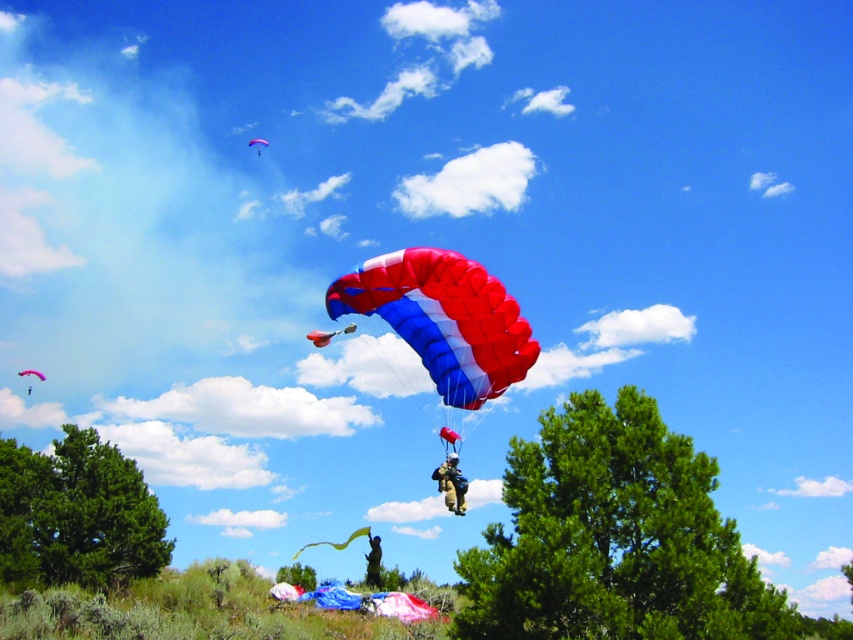
Who is shorter, yellow fabric parachute at center or red nylon parachute at upper center?

red nylon parachute at upper center

Where is `yellow fabric parachute at center`? This screenshot has width=853, height=640. yellow fabric parachute at center is located at coordinates (337, 541).

The width and height of the screenshot is (853, 640). I want to click on yellow fabric parachute at center, so click(x=337, y=541).

What do you see at coordinates (444, 317) in the screenshot? This screenshot has height=640, width=853. I see `red and blue fabric parachute at center` at bounding box center [444, 317].

Between red and blue fabric parachute at center and matte khaki jumpsuit at center, which one is positioned higher?

red and blue fabric parachute at center is above.

This screenshot has width=853, height=640. What do you see at coordinates (444, 317) in the screenshot?
I see `red and blue fabric parachute at center` at bounding box center [444, 317].

Locate an element on the screen. red and blue fabric parachute at center is located at coordinates (444, 317).

Can you confirm if green leafy tree at lower left is taller than blue/white nylon parachute at center?

Answer: Yes.

Can you confirm if green leafy tree at lower left is smaller than blue/white nylon parachute at center?

Actually, green leafy tree at lower left might be larger than blue/white nylon parachute at center.

Is point (135, 483) positioned in front of point (314, 342)?

No, (135, 483) is behind (314, 342).

At what (x,y) coordinates should I click in order to perform the action: click on green leafy tree at lower left. Please return your answer as a coordinate pair (x, y). Looking at the image, I should click on (x=76, y=515).